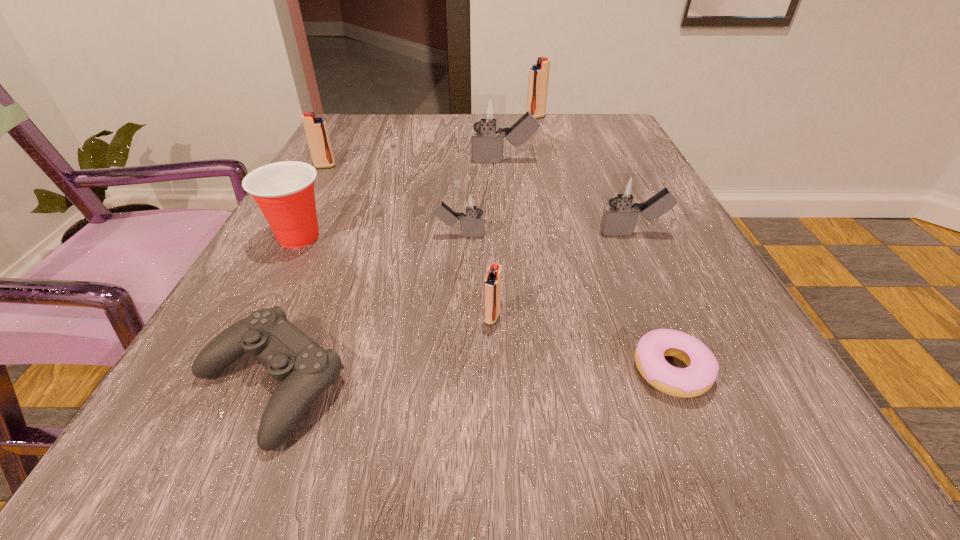
Locate which gray igniter is the closest to the nearest igniter. Please provide its 2D coordinates. Your answer should be formatted as a tuple, i.e. [(x, y)], where the tuple contains the x and y coordinates of a point satisfying the conditions above.

[(472, 203)]

Point out which gray igniter is positioned as the second nearest to the smallest gray igniter. Please provide its 2D coordinates. Your answer should be formatted as a tuple, i.e. [(x, y)], where the tuple contains the x and y coordinates of a point satisfying the conditions above.

[(488, 112)]

Identify the location of vacant position in the image that satisfies the following two spatial constraints: 1. on the back side of the smallest gray igniter; 2. on the left side of the gray control. The height and width of the screenshot is (540, 960). (334, 235).

You are a GUI agent. You are given a task and a screenshot of the screen. Output one action in this format:
    pyautogui.click(x=<x>, y=<y>)
    Task: Click on the vacant space that satisfies the following two spatial constraints: 1. on the front side of the shortest object; 2. on the left side of the smallest gray igniter
    
    Given the screenshot: What is the action you would take?
    pyautogui.click(x=452, y=370)

Locate an element on the screen. free space that satisfies the following two spatial constraints: 1. on the back side of the farthest gray igniter; 2. on the right side of the smallest red igniter is located at coordinates (488, 161).

In order to click on free space that satisfies the following two spatial constraints: 1. on the back side of the second biggest gray igniter; 2. on the right side of the smallest gray igniter in this screenshot , I will do `click(460, 233)`.